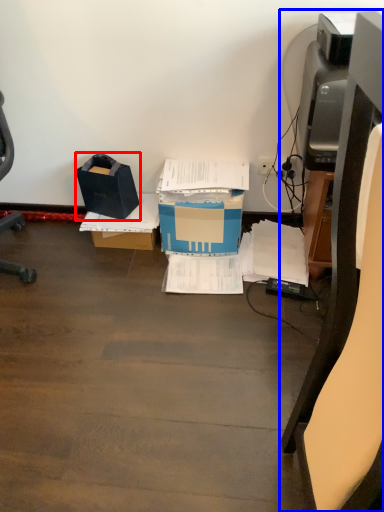
Question: Which of the following is the closest to the observer, box (highlighted by a red box) or furniture (highlighted by a blue box)?

Choices:
 (A) box
 (B) furniture

Answer: (B)